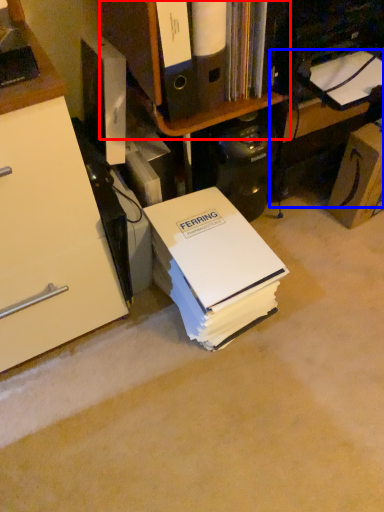
Question: Which object is closer to the camera taking this photo, shelf (highlighted by a red box) or computer desk (highlighted by a blue box)?

Choices:
 (A) shelf
 (B) computer desk

Answer: (A)